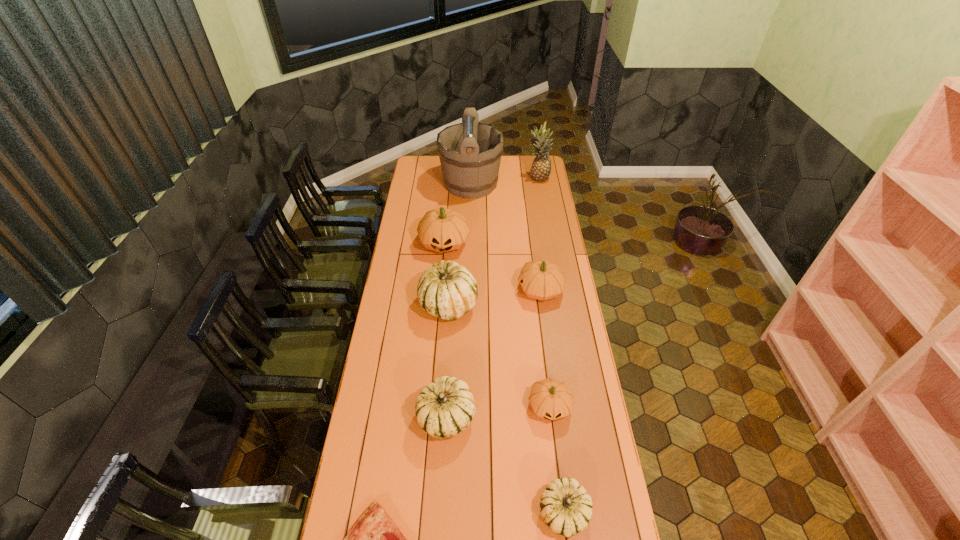
Identify the location of vacant space located 0.320m on the side of the biggest orange gourd with the carved face. This screenshot has height=540, width=960. (439, 309).

Identify the location of vacant region located on the front of the farthest white gourd. (445, 347).

You are a GUI agent. You are given a task and a screenshot of the screen. Output one action in this format:
    pyautogui.click(x=<x>, y=<y>)
    Task: Click on the vacant region located 0.080m on the side of the second nearest orange gourd with the carved face
    
    Given the screenshot: What is the action you would take?
    pyautogui.click(x=499, y=290)

Locate an element on the screen. vacant space located on the side of the second nearest orange gourd with the carved face is located at coordinates (452, 290).

You are a GUI agent. You are given a task and a screenshot of the screen. Output one action in this format:
    pyautogui.click(x=<x>, y=<y>)
    Task: Click on the free space located 0.170m on the side of the second nearest orange gourd with the carved face
    
    Given the screenshot: What is the action you would take?
    pyautogui.click(x=480, y=290)

The width and height of the screenshot is (960, 540). Identify the location of vacant space positioned on the right of the second smallest white gourd. (548, 416).

This screenshot has height=540, width=960. What are the coordinates of `vacant region located on the side of the smallest orange gourd with the carved face` in the screenshot? It's located at (560, 492).

The width and height of the screenshot is (960, 540). What are the coordinates of `bucket at the far edge` in the screenshot? It's located at (470, 152).

At what (x,y) coordinates should I click in order to perform the action: click on pineapple that is at the far edge. Please return your answer as a coordinate pair (x, y). Looking at the image, I should click on (541, 166).

At what (x,y) coordinates should I click in order to perform the action: click on pineapple that is at the right edge. Please return your answer as a coordinate pair (x, y). Looking at the image, I should click on point(541,166).